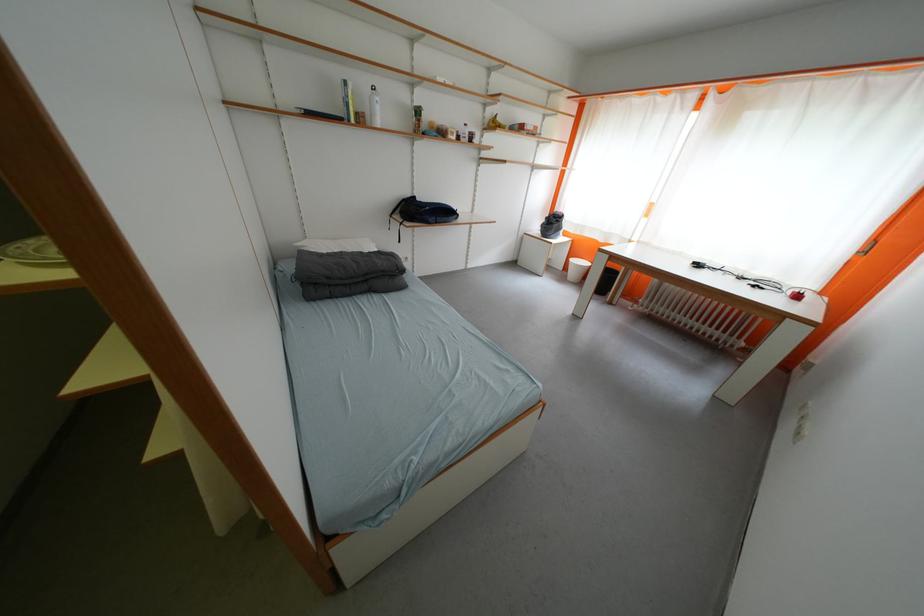
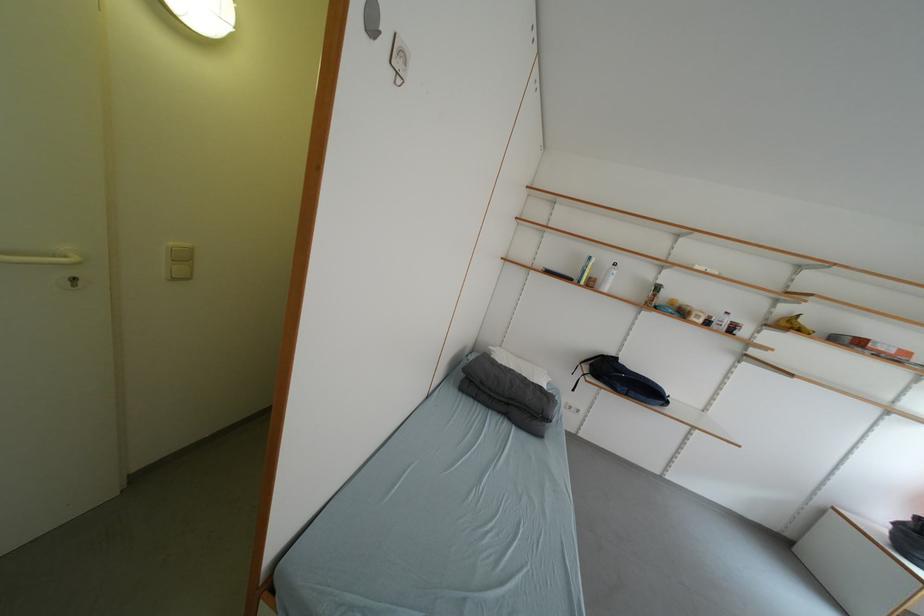
Locate, in the second image, the point that corresponds to the point at 371,124 in the first image.

(600, 286)